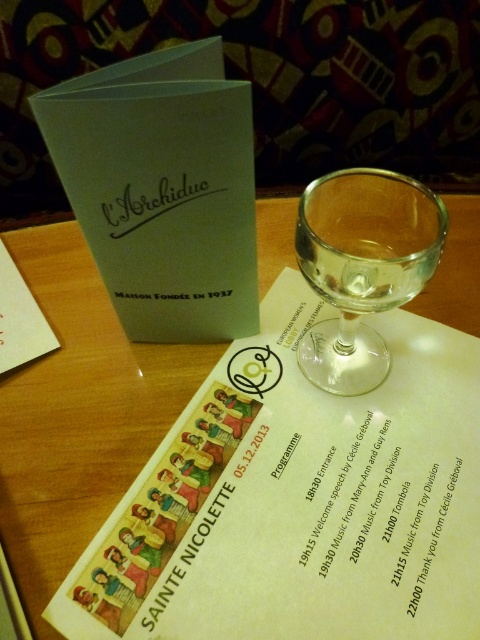
Does transparent glass wine glass at center have a greater width compared to clear glass wine at center?

Correct, the width of transparent glass wine glass at center exceeds that of clear glass wine at center.

Between transparent glass wine glass at center and clear glass wine at center, which one has more height?

Standing taller between the two is transparent glass wine glass at center.

Is point (312, 196) farther from viewer compared to point (315, 273)?

Yes, it is behind point (315, 273).

Where is `transparent glass wine glass at center`? Image resolution: width=480 pixels, height=640 pixels. transparent glass wine glass at center is located at coordinates (362, 266).

Who is more forward, (133,385) or (357,289)?

Positioned in front is point (357,289).

Which of these two, wooden table at center or clear glass wine at center, stands taller?

With more height is wooden table at center.

This screenshot has height=640, width=480. I want to click on wooden table at center, so click(76, 413).

Is wooden table at center smaller than transparent glass wine glass at center?

Actually, wooden table at center might be larger than transparent glass wine glass at center.

Is wooden table at center to the left of transparent glass wine glass at center from the viewer's perspective?

Yes, wooden table at center is to the left of transparent glass wine glass at center.

The height and width of the screenshot is (640, 480). I want to click on wooden table at center, so click(76, 413).

This screenshot has width=480, height=640. Find the location of `wooden table at center`. wooden table at center is located at coordinates (76, 413).